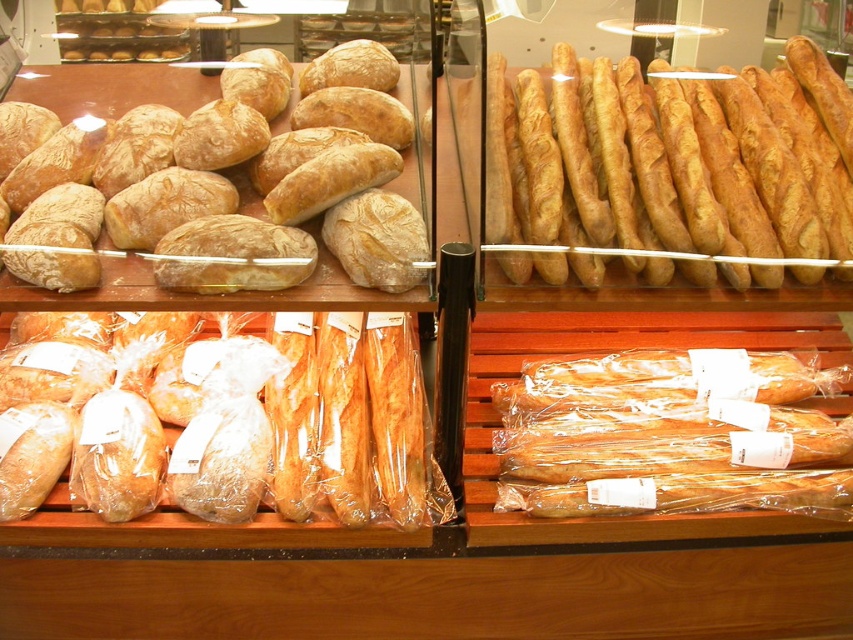
Question: Among these objects, which one is farthest from the camera?

Choices:
 (A) golden crispy baguette at upper right
 (B) golden brown baguette at lower left
 (C) golden crispy baguette at lower right

Answer: (C)

Question: Is golden crispy baguette at upper right bigger than matte brown loaf at upper left?

Choices:
 (A) yes
 (B) no

Answer: (B)

Question: Which point is farther to the camera?

Choices:
 (A) (120, 444)
 (B) (665, 381)

Answer: (B)

Question: Based on their relative distances, which object is farther from the golden brown baguette at lower left?

Choices:
 (A) golden crispy baguette at upper right
 (B) matte brown loaf at upper left
 (C) golden crispy baguette at lower right

Answer: (A)

Question: Is the position of golden brown baguette at lower left more distant than that of golden crispy baguette at lower right?

Choices:
 (A) no
 (B) yes

Answer: (A)

Question: Is golden brown baguette at lower left closer to the viewer compared to matte brown loaf at upper left?

Choices:
 (A) no
 (B) yes

Answer: (A)